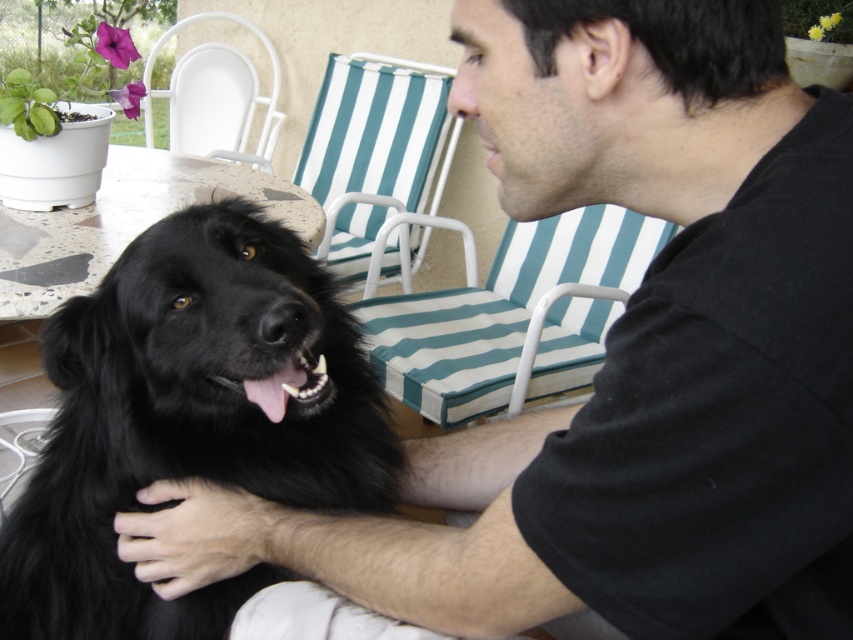
Can you confirm if black fluffy dog at center is positioned above white plastic chair at upper left?

Actually, black fluffy dog at center is below white plastic chair at upper left.

Who is taller, black fluffy dog at center or white plastic chair at upper left?

white plastic chair at upper left is taller.

Which is in front, point (318, 458) or point (235, 99)?

Point (318, 458) is more forward.

This screenshot has width=853, height=640. I want to click on black fluffy dog at center, so click(x=189, y=419).

Is teal striped cushion at center smaller than white plastic chair at upper left?

No.

Can you confirm if teal striped cushion at center is wider than white plastic chair at upper left?

Indeed, teal striped cushion at center has a greater width compared to white plastic chair at upper left.

Where is `teal striped cushion at center`? teal striped cushion at center is located at coordinates (514, 316).

Between teal striped cushion at center and teal striped fabric beach chair at upper center, which one is positioned lower?

teal striped cushion at center is below.

Does teal striped cushion at center lie behind teal striped fabric beach chair at upper center?

No, teal striped cushion at center is closer to the viewer.

Locate an element on the screen. The height and width of the screenshot is (640, 853). teal striped cushion at center is located at coordinates (514, 316).